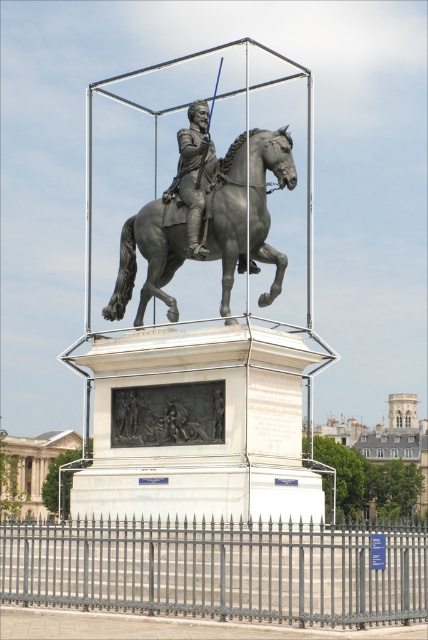
You are an art conservator standing at the entrance of the glass cube. You need to position a protective barrier around the polished bronze horse at center. Based on its current coordinates, which area should you prioritize for placement?

The polished bronze horse at center is located at point (149,257), so you should prioritize placing the protective barrier around that coordinate to ensure it is adequately safeguarded.